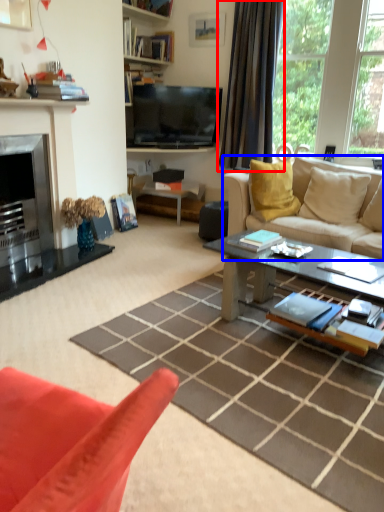
Question: Which of the following is the farthest to the observer, curtain (highlighted by a red box) or studio couch (highlighted by a blue box)?

Choices:
 (A) curtain
 (B) studio couch

Answer: (A)